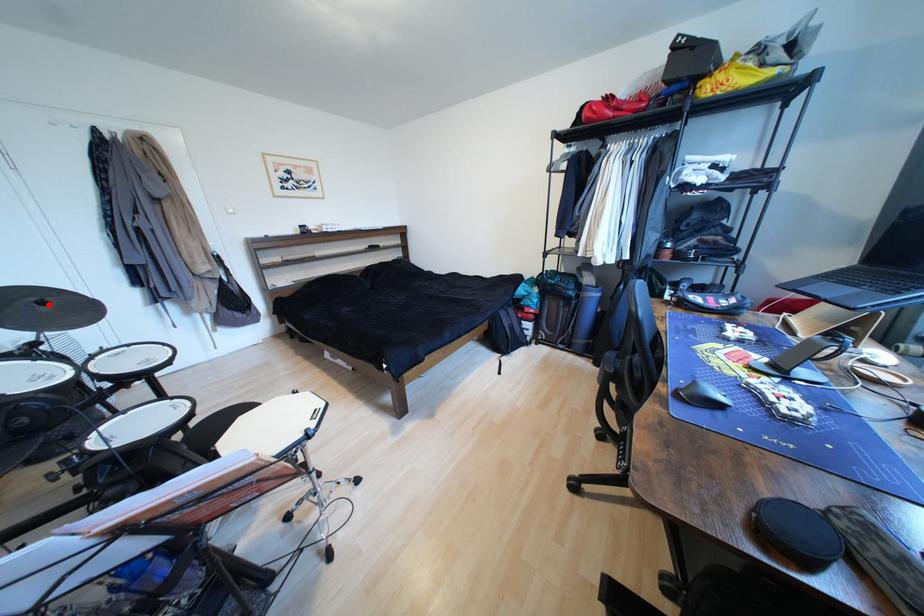
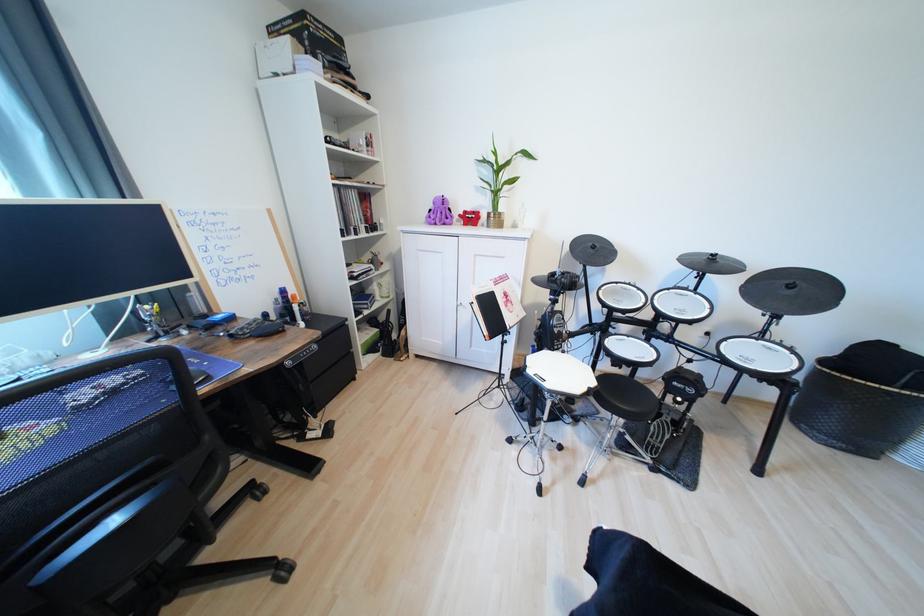
In the second image, find the point that corresponds to the highlighted location in the first image.

(797, 288)